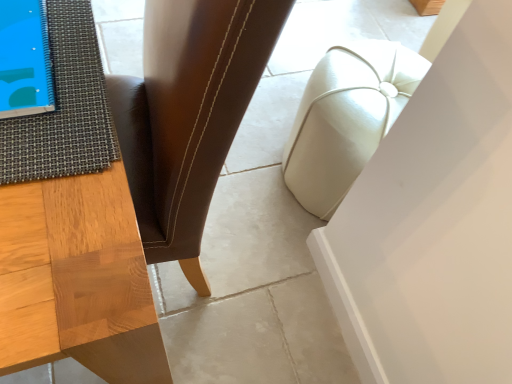
What is the approximate height of brown leather chair at center?

97.66 centimeters.

Image resolution: width=512 pixels, height=384 pixels. Describe the element at coordinates (346, 118) in the screenshot. I see `white leather ottoman at center` at that location.

You are a GUI agent. You are given a task and a screenshot of the screen. Output one action in this format:
    pyautogui.click(x=<x>, y=<y>)
    Task: Click on the brown leather chair at center
    This screenshot has height=384, width=512.
    Given the screenshot: What is the action you would take?
    pyautogui.click(x=188, y=114)

From a real-world perspective, which object stands above the other?

textured gray mat at left, from a real-world perspective.

Find the location of `mat that appears above the brown leather chair at center (from a real-world perspective)`. mat that appears above the brown leather chair at center (from a real-world perspective) is located at coordinates (64, 108).

Is textured gray mat at left inside or outside of brown leather chair at center?

textured gray mat at left exists entirely within brown leather chair at center.

Is textured gray mat at left turned away from brown leather chair at center?

Yes.

Considering the relative sizes of textured gray mat at left and white leather ottoman at center in the image provided, is textured gray mat at left smaller than white leather ottoman at center?

Yes.

Is the depth of textured gray mat at left less than that of white leather ottoman at center?

Yes, textured gray mat at left is closer to the camera.

From the image's perspective, relative to white leather ottoman at center, is textured gray mat at left above or below?

Clearly, from the image's perspective, textured gray mat at left is above white leather ottoman at center.

Which is behind, brown leather chair at center or textured gray mat at left?

textured gray mat at left is behind.

Can you confirm if brown leather chair at center is positioned to the right of textured gray mat at left?

Correct, you'll find brown leather chair at center to the right of textured gray mat at left.

Is brown leather chair at center far away from textured gray mat at left?

brown leather chair at center is near textured gray mat at left, not far away.

From a real-world perspective, is brown leather chair at center positioned above or below textured gray mat at left?

brown leather chair at center is situated lower than textured gray mat at left in the real world.

From a real-world perspective, is white leather ottoman at center under brown leather chair at center?

Correct, in the physical world, white leather ottoman at center is lower than brown leather chair at center.

In the image, is white leather ottoman at center positioned in front of or behind brown leather chair at center?

white leather ottoman at center is behind brown leather chair at center.

Is white leather ottoman at center in contact with brown leather chair at center?

No.

Between white leather ottoman at center and brown leather chair at center, which one has larger width?

With larger width is brown leather chair at center.

Considering the positions of objects brown leather chair at center and white leather ottoman at center in the image provided, who is more to the left, brown leather chair at center or white leather ottoman at center?

brown leather chair at center.

Is brown leather chair at center thinner than white leather ottoman at center?

In fact, brown leather chair at center might be wider than white leather ottoman at center.

Could white leather ottoman at center be considered to be inside brown leather chair at center?

Actually, white leather ottoman at center is outside brown leather chair at center.

How different are the orientations of brown leather chair at center and white leather ottoman at center in degrees?

There is a 83.7-degree angle between the facing directions of brown leather chair at center and white leather ottoman at center.

Considering the positions of objects white leather ottoman at center and textured gray mat at left in the image provided, who is in front, white leather ottoman at center or textured gray mat at left?

textured gray mat at left is more forward.

Is point (418, 67) positioned behind point (48, 160)?

Yes, point (418, 67) is behind point (48, 160).

Identify the location of mat above the white leather ottoman at center (from the image's perspective). (64, 108).

Find the location of a particular element. Image resolution: width=512 pixels, height=384 pixels. chair that is on the right side of textured gray mat at left is located at coordinates (188, 114).

Identify the location of mat above the white leather ottoman at center (from a real-world perspective). (64, 108).

Considering their positions, is brown leather chair at center positioned closer to white leather ottoman at center than textured gray mat at left?

brown leather chair at center is positioned closer to the anchor white leather ottoman at center.

Looking at the image, which one is located closer to brown leather chair at center, textured gray mat at left or white leather ottoman at center?

The object closer to brown leather chair at center is textured gray mat at left.

Based on their spatial positions, is brown leather chair at center or white leather ottoman at center further from textured gray mat at left?

white leather ottoman at center lies further to textured gray mat at left than the other object.

Looking at the image, which one is located further to textured gray mat at left, white leather ottoman at center or brown leather chair at center?

white leather ottoman at center lies further to textured gray mat at left than the other object.

From the image, which object appears to be nearer to brown leather chair at center, white leather ottoman at center or textured gray mat at left?

textured gray mat at left lies closer to brown leather chair at center than the other object.

Estimate the real-world distances between objects in this image. Which object is further from white leather ottoman at center, textured gray mat at left or brown leather chair at center?

The object further to white leather ottoman at center is textured gray mat at left.

Image resolution: width=512 pixels, height=384 pixels. Find the location of `chair situated between textured gray mat at left and white leather ottoman at center from left to right`. chair situated between textured gray mat at left and white leather ottoman at center from left to right is located at coordinates (188, 114).